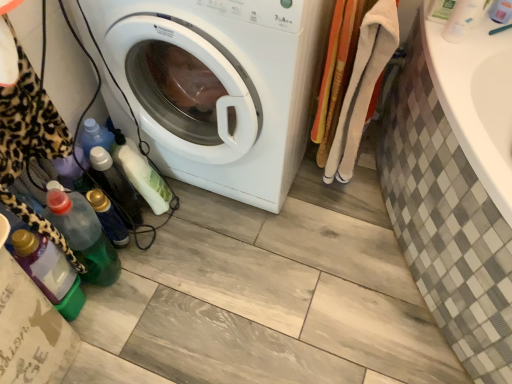
Question: Does translucent plastic bottle at lower left, acting as the third bottle starting from the left, have a lesser height compared to green matte bottle at upper right, which appears as the second bottle when viewed from the right?

Choices:
 (A) yes
 (B) no

Answer: (B)

Question: Is translucent plastic bottle at lower left, acting as the third bottle starting from the left, positioned in front of green matte bottle at upper right, the 6th bottle viewed from the left?

Choices:
 (A) no
 (B) yes

Answer: (A)

Question: From a real-world perspective, does translucent plastic bottle at lower left, the fifth bottle when ordered from right to left, stand above green matte bottle at upper right, the 6th bottle viewed from the left?

Choices:
 (A) yes
 (B) no

Answer: (B)

Question: From the image's perspective, does translucent plastic bottle at lower left, acting as the third bottle starting from the left, appear higher than green matte bottle at upper right, the 6th bottle viewed from the left?

Choices:
 (A) no
 (B) yes

Answer: (A)

Question: Could you tell me if translucent plastic bottle at lower left, acting as the third bottle starting from the left, is facing green matte bottle at upper right, which appears as the second bottle when viewed from the right?

Choices:
 (A) no
 (B) yes

Answer: (A)

Question: From their relative heights in the image, would you say white matte bottle at upper right, which ranks as the first bottle in right-to-left order, is taller or shorter than green matte bottle at upper right, the 6th bottle viewed from the left?

Choices:
 (A) tall
 (B) short

Answer: (A)

Question: Is white matte bottle at upper right, which ranks as the first bottle in right-to-left order, in front of or behind green matte bottle at upper right, the 6th bottle viewed from the left, in the image?

Choices:
 (A) front
 (B) behind

Answer: (A)

Question: Is white matte bottle at upper right, acting as the 7th bottle starting from the left, wider or thinner than green matte bottle at upper right, which appears as the second bottle when viewed from the right?

Choices:
 (A) thin
 (B) wide

Answer: (A)

Question: Choose the correct answer: Is white matte bottle at upper right, which ranks as the first bottle in right-to-left order, inside green matte bottle at upper right, the 6th bottle viewed from the left, or outside it?

Choices:
 (A) outside
 (B) inside

Answer: (A)

Question: Visually, is white plastic bottle at upper right positioned to the left or to the right of translucent plastic bottle at lower left, the 1th bottle from the left?

Choices:
 (A) left
 (B) right

Answer: (B)

Question: In terms of height, does white plastic bottle at upper right look taller or shorter compared to translucent plastic bottle at lower left, the 7th bottle positioned from the right?

Choices:
 (A) short
 (B) tall

Answer: (A)

Question: Is point (504, 8) positioned closer to the camera than point (31, 259)?

Choices:
 (A) farther
 (B) closer

Answer: (A)

Question: From the image's perspective, is white plastic bottle at upper right positioned above or below translucent plastic bottle at lower left, the 7th bottle positioned from the right?

Choices:
 (A) below
 (B) above

Answer: (B)

Question: Considering the positions of white glossy washing machine at center and translucent plastic bottle at lower left, the fourth bottle from the right, in the image, is white glossy washing machine at center bigger or smaller than translucent plastic bottle at lower left, the fourth bottle from the right,?

Choices:
 (A) small
 (B) big

Answer: (B)

Question: Which is correct: white glossy washing machine at center is inside translucent plastic bottle at lower left, which is counted as the fourth bottle, starting from the left, or outside of it?

Choices:
 (A) inside
 (B) outside

Answer: (B)